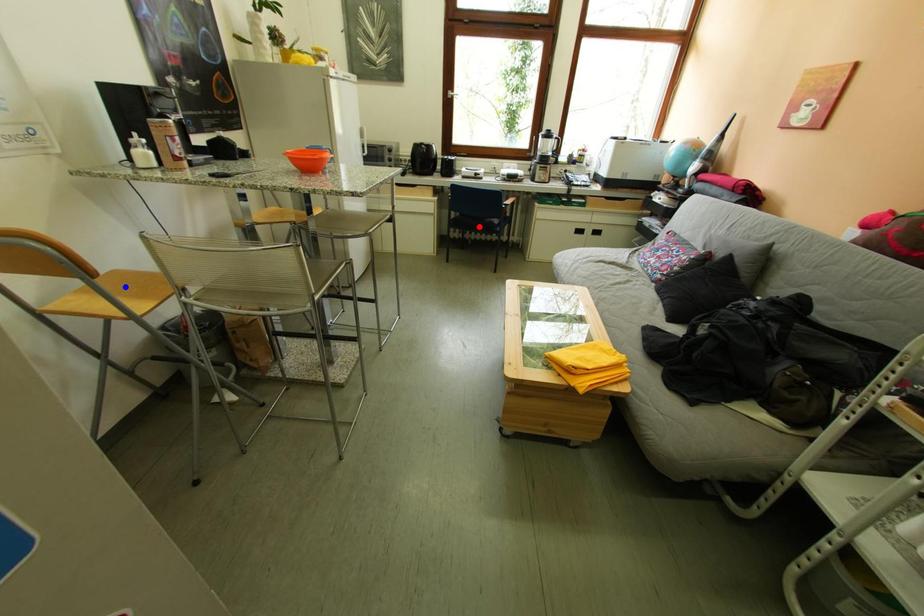
Question: Which of the two points in the image is closer to the camera?

Choices:
 (A) Blue point is closer.
 (B) Red point is closer.

Answer: (A)